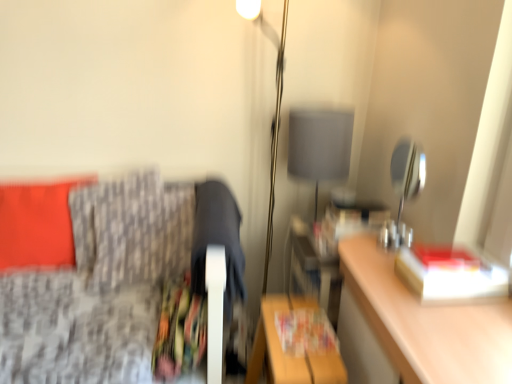
Question: Considering the positions of point (409, 230) and point (457, 256), is point (409, 230) closer or farther from the camera than point (457, 256)?

Choices:
 (A) farther
 (B) closer

Answer: (A)

Question: In terms of size, does metallic gray lampshade at upper right, which is counted as the 1th table lamp, starting from the front, appear bigger or smaller than hardcover book at right?

Choices:
 (A) small
 (B) big

Answer: (B)

Question: Which object is the farthest from the printed paper magazine at lower center, which is the first magazine from front to back?

Choices:
 (A) matte orange pillow at left, placed as the first pillow when sorted from left to right
 (B) matte paper magazine at center, the 1th magazine when ordered from right to left
 (C) matte gray lampshade at center, which is counted as the 1th table lamp, starting from the back
 (D) patterned fabric couch at left
 (E) hardcover book at right

Answer: (A)

Question: Estimate the real-world distances between objects in this image. Which object is closer to the patterned fabric couch at left?

Choices:
 (A) printed paper magazine at lower center, which ranks as the first magazine in bottom-to-top order
 (B) wooden table at lower center
 (C) hardcover book at right
 (D) metallic gray lampshade at upper right, positioned as the first table lamp in right-to-left order
 (E) matte orange pillow at left, which ranks as the second pillow in right-to-left order

Answer: (E)